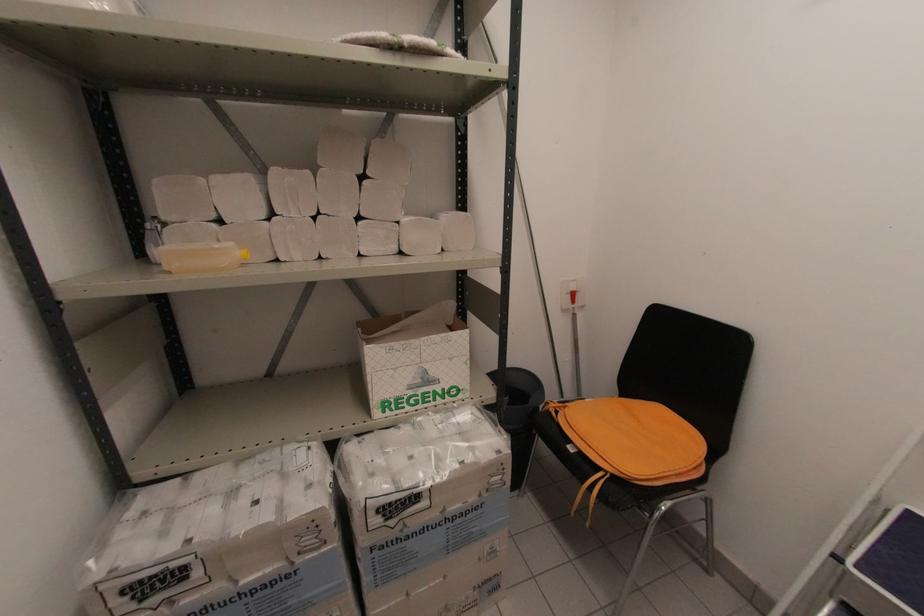
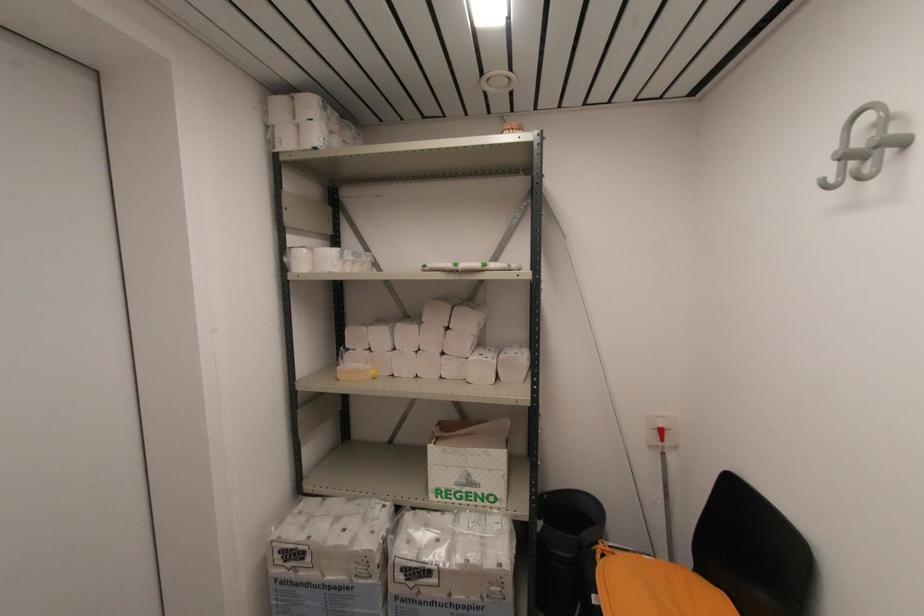
Where in the second image is the point corresponding to [565,408] from the first image?

(614, 554)